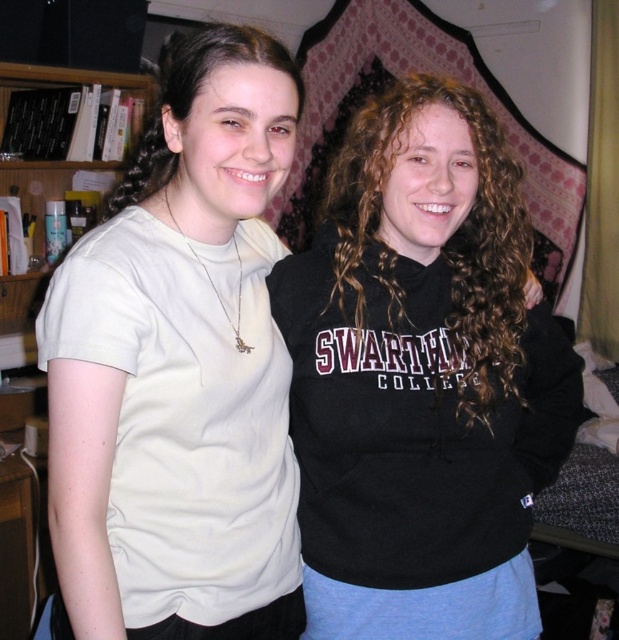
What do you see at coordinates (180, 371) in the screenshot? The image size is (619, 640). I see `white matte t-shirt at left` at bounding box center [180, 371].

Which is above, white matte t-shirt at left or brownhair at left?

brownhair at left is above.

Is point (243, 93) positioned behind point (232, 38)?

No, (243, 93) is in front of (232, 38).

This screenshot has width=619, height=640. I want to click on white matte t-shirt at left, so click(180, 371).

Does black matte hoodie at right appear over matte wood bookshelf at left?

No, black matte hoodie at right is not above matte wood bookshelf at left.

Where is `black matte hoodie at right`? black matte hoodie at right is located at coordinates (422, 378).

Between point (220, 33) and point (6, 84), which one is positioned behind?

Point (6, 84)

Does white matte t-shirt at left have a smaller size compared to matte wood bookshelf at left?

Indeed, white matte t-shirt at left has a smaller size compared to matte wood bookshelf at left.

Who is more distant from viewer, (132, 224) or (37, 300)?

Positioned behind is point (37, 300).

Locate an element on the screen. white matte t-shirt at left is located at coordinates (180, 371).